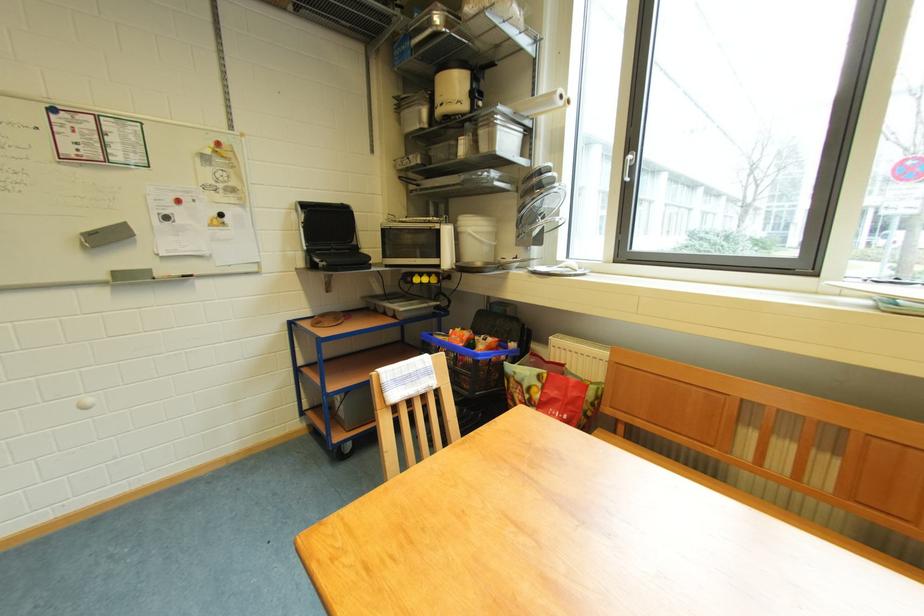
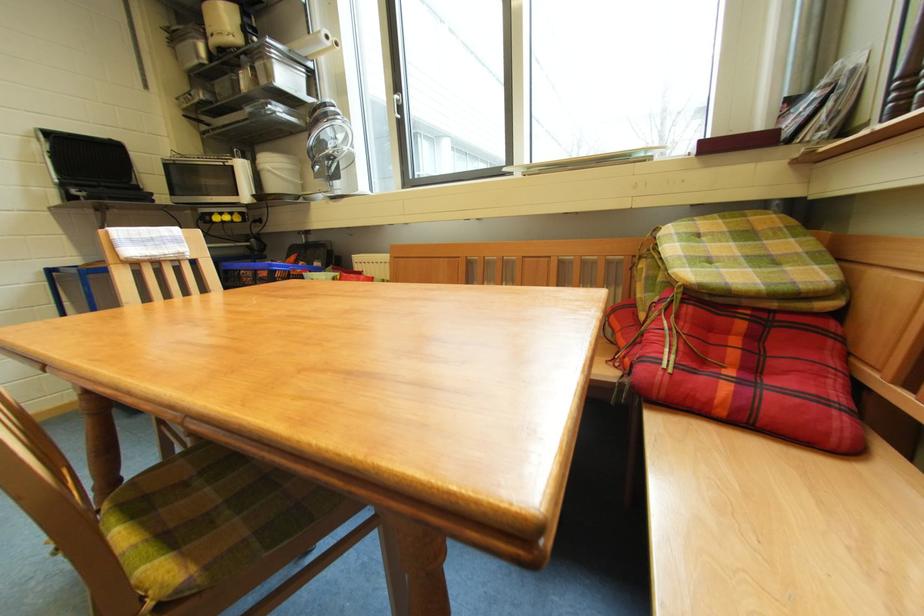
Find the pixel in the second image that matches the point at 560,103 in the first image.

(326, 44)